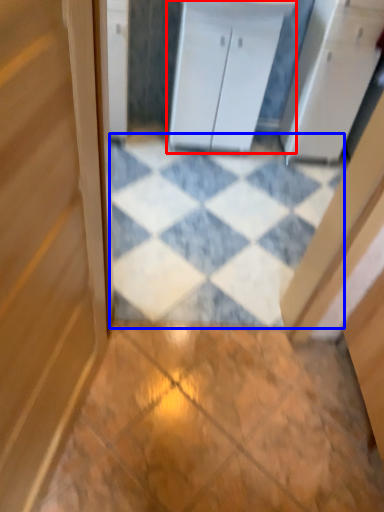
Question: Which of the following is the closest to the observer, cabinetry (highlighted by a red box) or tile (highlighted by a blue box)?

Choices:
 (A) cabinetry
 (B) tile

Answer: (B)